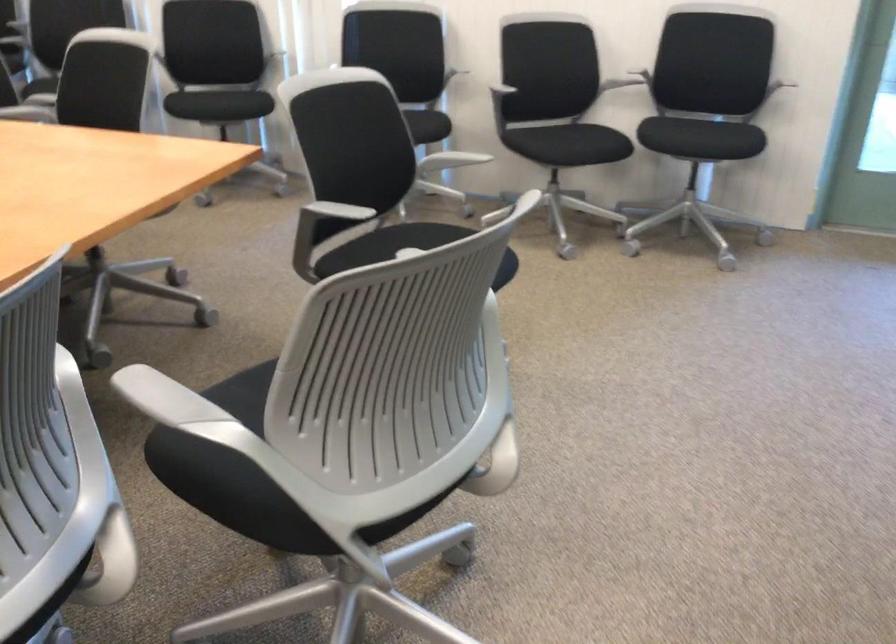
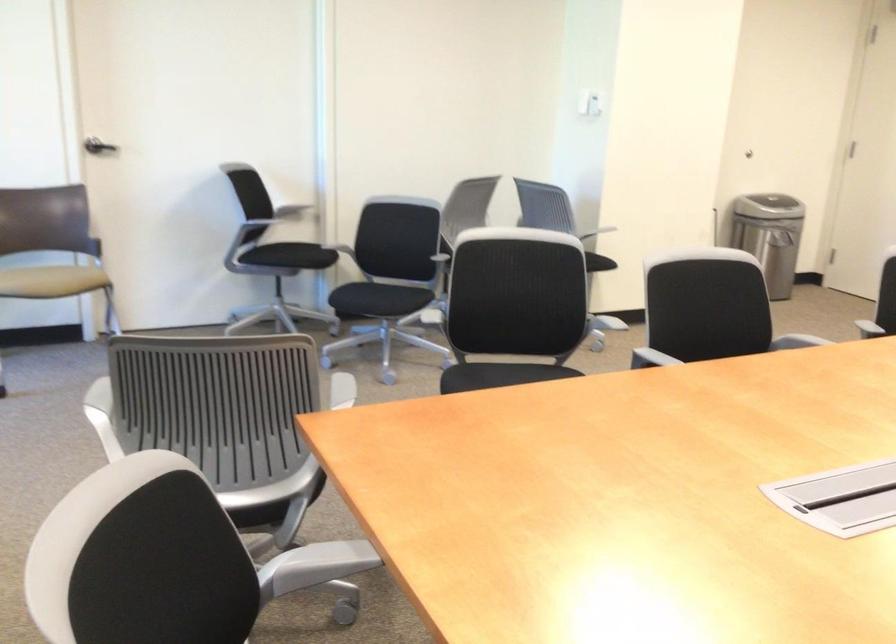
Find the pixel in the second image that matches (x=403, y=381) in the first image.

(513, 307)